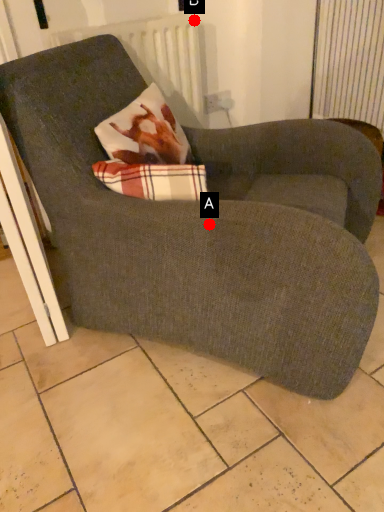
Question: Two points are circled on the image, labeled by A and B beside each circle. Which point is closer to the camera?

Choices:
 (A) A is closer
 (B) B is closer

Answer: (A)